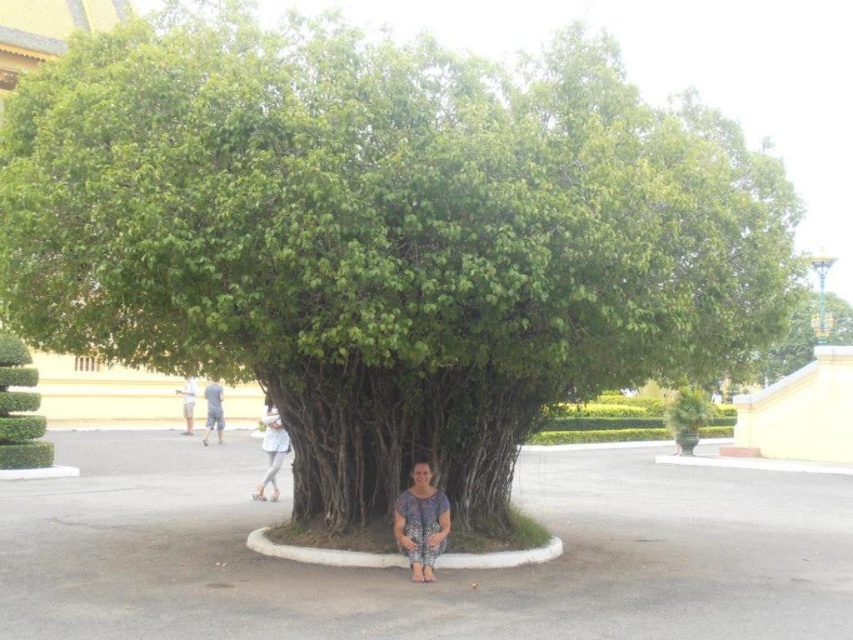
You are a photographer setting up for a shoot in the park. You need to position a model so that the printed fabric squat at center and the white cotton shirt at center are both visible in the frame. Which object should be placed to the right side of the frame to ensure both are visible?

The printed fabric squat at center should be placed to the right side of the frame because it is already positioned to the right of the white cotton shirt at center, ensuring both are visible when framed properly.